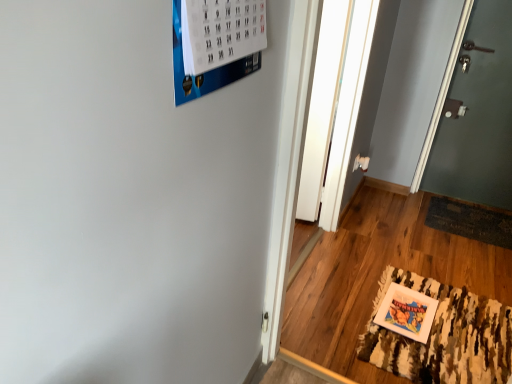
This screenshot has height=384, width=512. Find the location of `free space in front of dark brown woven mat at lower right`. free space in front of dark brown woven mat at lower right is located at coordinates (472, 254).